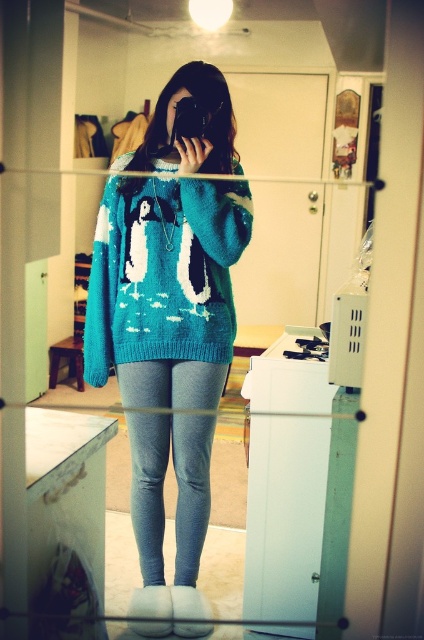
Is teal knitted sweater at center positioned before gray knit leggings at center?

That is True.

Between point (100, 324) and point (169, 416), which one is positioned behind?

Positioned behind is point (169, 416).

I want to click on teal knitted sweater at center, so click(164, 273).

Who is more forward, (151,333) or (175,234)?

Point (175,234)

Locate an element on the screen. turquoise knitted sweater at center is located at coordinates (170, 316).

Is turquoise knitted sweater at center above gray knit leggings at center?

Yes.

Between turquoise knitted sweater at center and gray knit leggings at center, which one has more height?

turquoise knitted sweater at center

Describe the element at coordinates (170, 316) in the screenshot. I see `turquoise knitted sweater at center` at that location.

You are a GUI agent. You are given a task and a screenshot of the screen. Output one action in this format:
    pyautogui.click(x=<x>, y=<y>)
    Task: Click on the turquoise knitted sweater at center
    
    Given the screenshot: What is the action you would take?
    pyautogui.click(x=170, y=316)